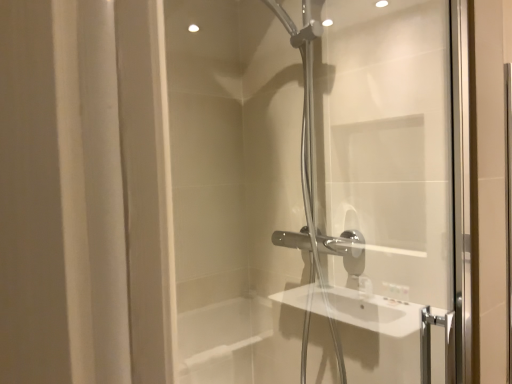
You are a GUI agent. You are given a task and a screenshot of the screen. Output one action in this format:
    pyautogui.click(x=<x>, y=<y>)
    Task: Click on the transparent glass door at center
    The image size is (512, 384).
    Given the screenshot: What is the action you would take?
    pyautogui.click(x=317, y=190)

Describe the element at coordinates (317, 190) in the screenshot. I see `transparent glass door at center` at that location.

Where is `transparent glass door at center`? The height and width of the screenshot is (384, 512). transparent glass door at center is located at coordinates (317, 190).